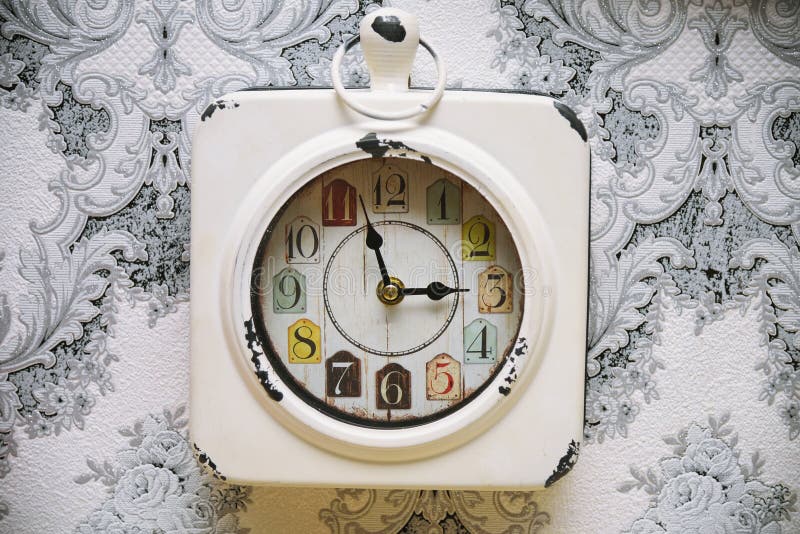
Locate an element on the screen. The height and width of the screenshot is (534, 800). chipped paint is located at coordinates (392, 27).